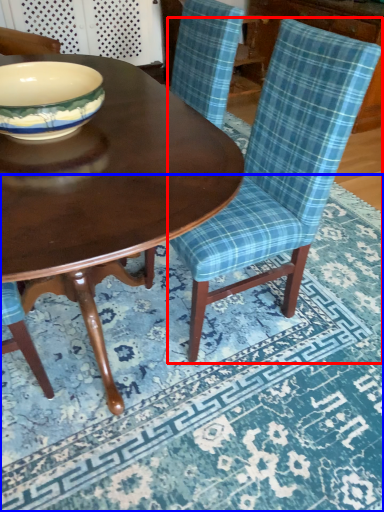
Question: Which of the following is the closest to the observer, chair (highlighted by a red box) or place mat (highlighted by a blue box)?

Choices:
 (A) chair
 (B) place mat

Answer: (B)